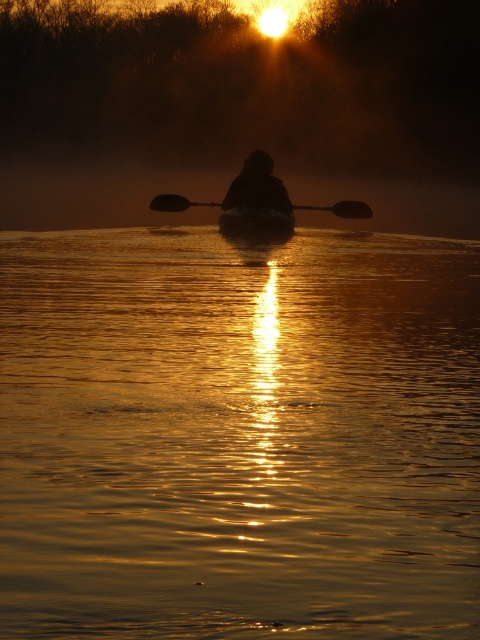
Question: Which point is closer to the camera taking this photo?

Choices:
 (A) (384, 186)
 (B) (252, 161)
 (C) (259, 216)
 (D) (103, 490)

Answer: (D)

Question: Which is nearer to the golden reflective water at center?

Choices:
 (A) smooth dark wood canoe at center
 (B) black rubber paddle at center
 (C) silhouette figure at center

Answer: (C)

Question: Observing the image, what is the correct spatial positioning of golden reflective water at center in reference to black rubber paddle at center?

Choices:
 (A) above
 (B) below

Answer: (B)

Question: Does silhouette figure at center appear under black rubber paddle at center?

Choices:
 (A) yes
 (B) no

Answer: (B)

Question: Is the position of golden reflective water at center more distant than that of black rubber paddle at center?

Choices:
 (A) yes
 (B) no

Answer: (B)

Question: Which object appears closest to the camera in this image?

Choices:
 (A) foggy mist at upper center
 (B) silhouette figure at center
 (C) black rubber paddle at center

Answer: (B)